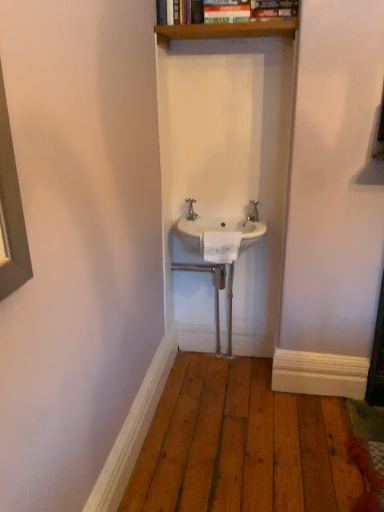
Question: From the image's perspective, is white ceramic sink at center above or below wooden shelf at upper center?

Choices:
 (A) above
 (B) below

Answer: (B)

Question: From a real-world perspective, is white ceramic sink at center positioned above or below wooden shelf at upper center?

Choices:
 (A) above
 (B) below

Answer: (B)

Question: Which of these objects is positioned farthest from the wooden shelf at upper center?

Choices:
 (A) silver metallic tap at center
 (B) white ceramic sink at center
 (C) white plastic towel bar at center

Answer: (C)

Question: Estimate the real-world distances between objects in this image. Which object is farther from the silver metallic tap at center?

Choices:
 (A) white plastic towel bar at center
 (B) white ceramic sink at center
 (C) wooden shelf at upper center

Answer: (C)